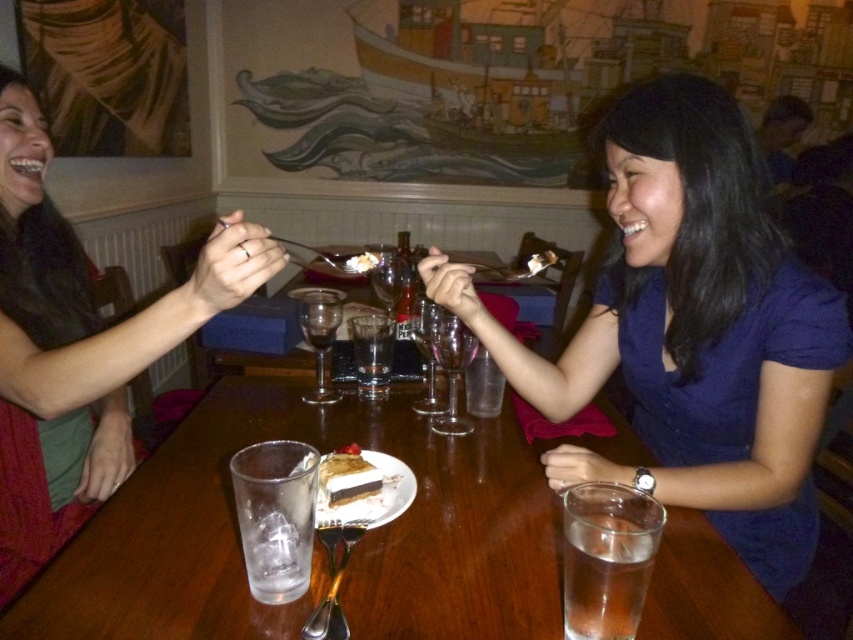
Is point (334, 484) farther from viewer compared to point (366, 253)?

No.

Identify the location of chocolate cake at center. Image resolution: width=853 pixels, height=640 pixels. (355, 476).

Is point (338, 484) in front of point (361, 259)?

Yes, it is.

Locate an element on the screen. This screenshot has height=640, width=853. chocolate cake at center is located at coordinates (355, 476).

Does point (579, 524) come farther from viewer compared to point (364, 253)?

No, (579, 524) is closer to viewer.

Who is more forward, (x=595, y=552) or (x=364, y=253)?

Positioned in front is point (x=595, y=552).

In order to click on clear glass at lower center in this screenshot , I will do [x=605, y=572].

Image resolution: width=853 pixels, height=640 pixels. What do you see at coordinates (691, 330) in the screenshot?
I see `blue smooth dress at center` at bounding box center [691, 330].

Can you confirm if blue smooth dress at center is shorter than white creamy dessert at center?

No, blue smooth dress at center is not shorter than white creamy dessert at center.

In order to click on blue smooth dress at center in this screenshot , I will do `click(691, 330)`.